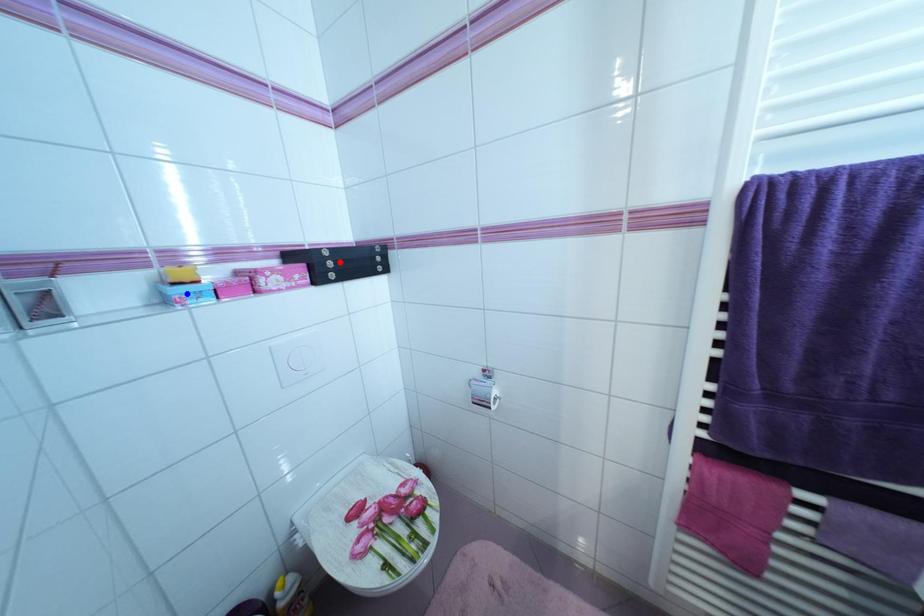
Question: Two points are marked on the image. Which point is closer to the camera?

Choices:
 (A) Blue point is closer.
 (B) Red point is closer.

Answer: (A)